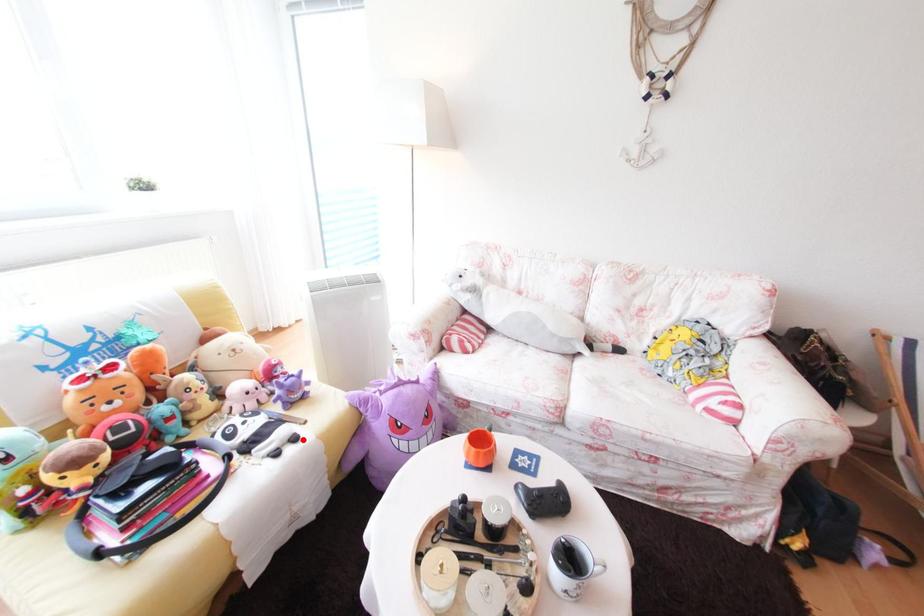
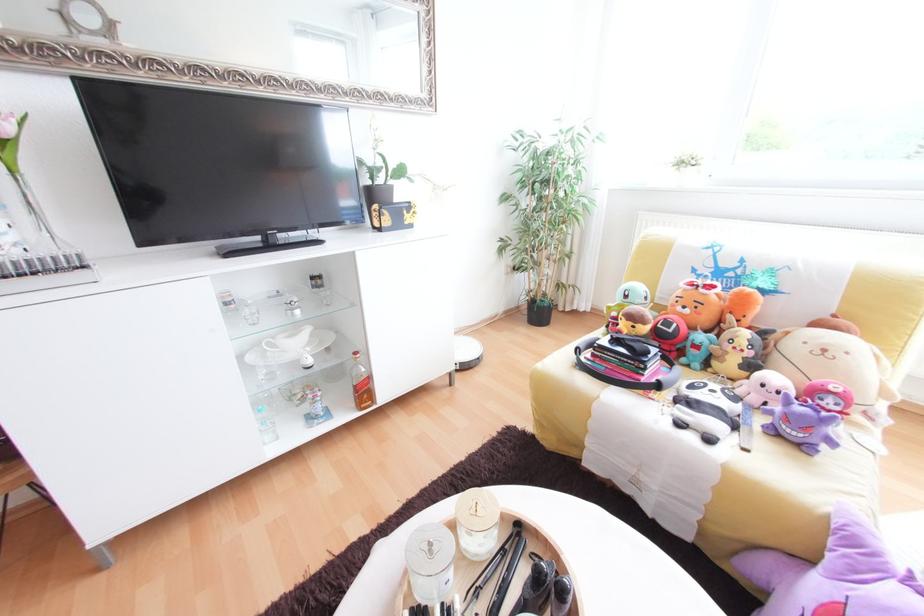
In the second image, find the point that corresponds to the highlighted location in the first image.

(718, 440)